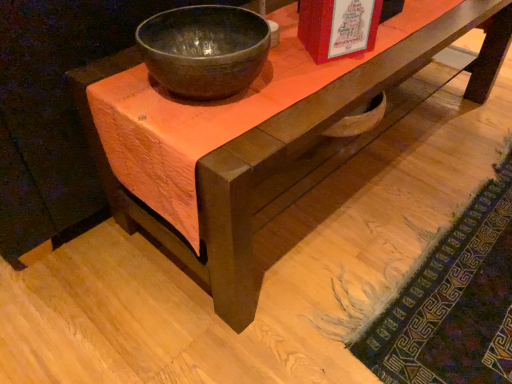
Where is `vacant area situated to the left side of matte dark gray bowl at center`? The height and width of the screenshot is (384, 512). vacant area situated to the left side of matte dark gray bowl at center is located at coordinates (114, 80).